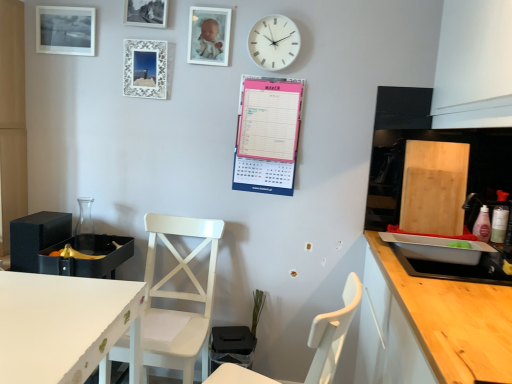
From the picture: Measure the distance between white matte chair at center, which is counted as the 2th chair, starting from the front, and camera.

white matte chair at center, which is counted as the 2th chair, starting from the front, and camera are 1.33 meters apart.

What is the approximate width of pink paperboard at upper center?

pink paperboard at upper center is 3.83 inches wide.

Describe the element at coordinates (267, 135) in the screenshot. I see `pink paperboard at upper center` at that location.

In order to face white wooden chair at center, acting as the first chair starting from the front, should I rotate leftwards or rightwards?

Rotate right and turn 0.952 degrees.

Identify the location of white plastic sink at right. (445, 262).

At what (x,y) coordinates should I click in order to perform the action: click on white glossy picture frame at upper center, which is the first picture frame in right-to-left order. Please return your answer as a coordinate pair (x, y). This screenshot has width=512, height=384. Looking at the image, I should click on (209, 35).

From a real-world perspective, does pink glossy bottle at right stand above white glossy picture frame at upper center, which ranks as the fourth picture frame in left-to-right order?

Actually, pink glossy bottle at right is physically below white glossy picture frame at upper center, which ranks as the fourth picture frame in left-to-right order, in the real world.

From the image's perspective, relative to white glossy picture frame at upper center, which is the first picture frame in right-to-left order, is pink glossy bottle at right above or below?

Clearly, from the image's perspective, pink glossy bottle at right is below white glossy picture frame at upper center, which is the first picture frame in right-to-left order.

Can you confirm if pink glossy bottle at right is positioned to the right of white glossy picture frame at upper center, which ranks as the fourth picture frame in left-to-right order?

Yes.

Is pink glossy bottle at right touching white glossy picture frame at upper center, which is the first picture frame in right-to-left order?

pink glossy bottle at right and white glossy picture frame at upper center, which is the first picture frame in right-to-left order, are clearly separated.

Would you say white plastic wall clock at upper center is inside or outside white matte chair at center, placed as the first chair when sorted from back to front?

white plastic wall clock at upper center is not inside white matte chair at center, placed as the first chair when sorted from back to front, it's outside.

Is white plastic wall clock at upper center further to camera compared to white matte chair at center, placed as the first chair when sorted from back to front?

Yes, white plastic wall clock at upper center is further from the camera.

Identify the location of wall clock lying behind the white matte chair at center, which is counted as the 2th chair, starting from the front. (274, 42).

From the image's perspective, is white plastic wall clock at upper center on white matte chair at center, which is counted as the 2th chair, starting from the front?

Yes, from the image's perspective, white plastic wall clock at upper center is on top of white matte chair at center, which is counted as the 2th chair, starting from the front.

Is white wooden chair at center, acting as the first chair starting from the front, inside the boundaries of pink glossy bottle at right, or outside?

white wooden chair at center, acting as the first chair starting from the front, cannot be found inside pink glossy bottle at right.

How much distance is there between white wooden chair at center, acting as the first chair starting from the front, and pink glossy bottle at right?

white wooden chair at center, acting as the first chair starting from the front, is 1.04 meters away from pink glossy bottle at right.

Is white wooden chair at center, acting as the first chair starting from the front, oriented towards pink glossy bottle at right?

No, white wooden chair at center, acting as the first chair starting from the front, is not facing towards pink glossy bottle at right.

Is white wooden chair at center, placed as the second chair when sorted from back to front, touching pink glossy bottle at right?

No, white wooden chair at center, placed as the second chair when sorted from back to front, is not making contact with pink glossy bottle at right.

Where is `chair that is the 2nd one below the matte black picture frame at upper left, the fourth picture frame in the right-to-left sequence (from a real-world perspective)`? The width and height of the screenshot is (512, 384). chair that is the 2nd one below the matte black picture frame at upper left, the fourth picture frame in the right-to-left sequence (from a real-world perspective) is located at coordinates pos(178,298).

Can you confirm if matte black picture frame at upper left, the fourth picture frame in the right-to-left sequence, is thinner than white matte chair at center, which is counted as the 2th chair, starting from the front?

Yes.

Do you think matte black picture frame at upper left, acting as the first picture frame starting from the left, is within white matte chair at center, which is counted as the 2th chair, starting from the front, or outside of it?

matte black picture frame at upper left, acting as the first picture frame starting from the left, is outside white matte chair at center, which is counted as the 2th chair, starting from the front.

From the image's perspective, is matte black picture frame at upper left, acting as the first picture frame starting from the left, above or below white matte chair at center, which is counted as the 2th chair, starting from the front?

matte black picture frame at upper left, acting as the first picture frame starting from the left, is situated higher than white matte chair at center, which is counted as the 2th chair, starting from the front, in the image.

Is wooden countertop at right spatially inside white matte table at lower left, or outside of it?

wooden countertop at right is located beyond the bounds of white matte table at lower left.

Identify the location of cabinetry above the white matte table at lower left (from the image's perspective). (453, 321).

Are wooden countertop at right and white matte table at lower left located far from each other?

wooden countertop at right is far away from white matte table at lower left.

Considering the positions of objects wooden countertop at right and white matte table at lower left in the image provided, who is more to the left, wooden countertop at right or white matte table at lower left?

white matte table at lower left is more to the left.

In the scene shown: From a real-world perspective, is white glossy picture frame at upper center, which ranks as the fourth picture frame in left-to-right order, positioned over white matte chair at center, placed as the first chair when sorted from back to front, based on gravity?

Correct, in the physical world, white glossy picture frame at upper center, which ranks as the fourth picture frame in left-to-right order, is higher than white matte chair at center, placed as the first chair when sorted from back to front.

Is white matte chair at center, which is counted as the 2th chair, starting from the front, located within white glossy picture frame at upper center, which is the first picture frame in right-to-left order?

That's incorrect, white matte chair at center, which is counted as the 2th chair, starting from the front, is not inside white glossy picture frame at upper center, which is the first picture frame in right-to-left order.

From a real-world perspective, count 2nd picture frames upward from the white matte chair at center, which is counted as the 2th chair, starting from the front, and point to it. Please provide its 2D coordinates.

[(209, 35)]

Is white glossy picture frame at upper center, which ranks as the fourth picture frame in left-to-right order, directly adjacent to white matte chair at center, placed as the first chair when sorted from back to front?

No.

Would you say wooden countertop at right is to the left or to the right of white matte chair at center, which is counted as the 2th chair, starting from the front, in the picture?

Clearly, wooden countertop at right is on the right of white matte chair at center, which is counted as the 2th chair, starting from the front, in the image.

From the picture: Is wooden countertop at right facing away from white matte chair at center, which is counted as the 2th chair, starting from the front?

No, wooden countertop at right is not facing the opposite direction of white matte chair at center, which is counted as the 2th chair, starting from the front.

Considering the sizes of objects wooden countertop at right and white matte chair at center, which is counted as the 2th chair, starting from the front, in the image provided, who is shorter, wooden countertop at right or white matte chair at center, which is counted as the 2th chair, starting from the front,?

wooden countertop at right is shorter.

How many degrees apart are the facing directions of wooden countertop at right and white matte chair at center, placed as the first chair when sorted from back to front?

They differ by 89.9 degrees in their facing directions.

Locate an element on the screen. picture frame that is the 1st one when counting backward from the pink glossy bottle at right is located at coordinates (209, 35).

Find the location of a particular element. The image size is (512, 384). the 2nd chair below the white plastic wall clock at upper center (from a real-world perspective) is located at coordinates (178, 298).

Based on their spatial positions, is matte black picture frame at upper left, acting as the first picture frame starting from the left, or white plastic wall clock at upper center further from wooden countertop at right?

The object further to wooden countertop at right is matte black picture frame at upper left, acting as the first picture frame starting from the left.

From the image, which object appears to be farther from metallic silver picture frame at upper center, which is the third picture frame from left to right, white matte table at lower left or white matte chair at center, which is counted as the 2th chair, starting from the front?

Based on the image, white matte table at lower left appears to be further to metallic silver picture frame at upper center, which is the third picture frame from left to right.

Based on their spatial positions, is white matte table at lower left or metallic silver picture frame at upper center, which is the third picture frame from left to right, closer to wooden countertop at right?

The object closer to wooden countertop at right is white matte table at lower left.

Estimate the real-world distances between objects in this image. Which object is further from white wooden chair at center, acting as the first chair starting from the front, white lace picture frame at upper center, the 2th picture frame viewed from the left, or white matte chair at center, which is counted as the 2th chair, starting from the front?

Among the two, white lace picture frame at upper center, the 2th picture frame viewed from the left, is located further to white wooden chair at center, acting as the first chair starting from the front.

Estimate the real-world distances between objects in this image. Which object is further from white plastic wall clock at upper center, pink paperboard at upper center or wooden countertop at right?

wooden countertop at right lies further to white plastic wall clock at upper center than the other object.

When comparing their distances from pink glossy bottle at right, does metallic silver picture frame at upper center, the second picture frame in the right-to-left sequence, or white wooden chair at center, placed as the second chair when sorted from back to front, seem further?

metallic silver picture frame at upper center, the second picture frame in the right-to-left sequence, is positioned further to the anchor pink glossy bottle at right.

Considering their positions, is metallic silver picture frame at upper center, the second picture frame in the right-to-left sequence, positioned closer to white glossy picture frame at upper center, which ranks as the fourth picture frame in left-to-right order, than pink glossy bottle at right?

metallic silver picture frame at upper center, the second picture frame in the right-to-left sequence, is positioned closer to the anchor white glossy picture frame at upper center, which ranks as the fourth picture frame in left-to-right order.

From the image, which object appears to be farther from pink paperboard at upper center, white wooden chair at center, acting as the first chair starting from the front, or white matte table at lower left?

Based on the image, white matte table at lower left appears to be further to pink paperboard at upper center.

This screenshot has height=384, width=512. Identify the location of wall clock between pink paperboard at upper center and pink glossy bottle at right in the horizontal direction. (274, 42).

At what (x,y) coordinates should I click in order to perform the action: click on sink between metallic silver picture frame at upper center, which is the third picture frame from left to right, and wooden countertop at right from left to right. Please return your answer as a coordinate pair (x, y). The width and height of the screenshot is (512, 384). Looking at the image, I should click on (445, 262).

Find the location of a particular element. The height and width of the screenshot is (384, 512). bulletin board between matte black picture frame at upper left, acting as the first picture frame starting from the left, and white plastic wall clock at upper center from left to right is located at coordinates (267, 135).

Identify the location of chair situated between white matte chair at center, which is counted as the 2th chair, starting from the front, and white plastic sink at right from left to right. Image resolution: width=512 pixels, height=384 pixels. (332, 334).